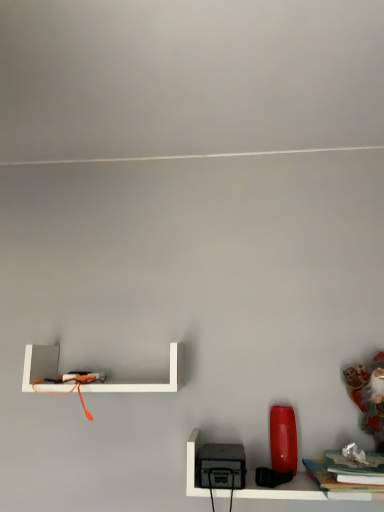
Question: Considering the relative sizes of matte black toaster at lower right, the first shelf from the right, and white matte shelf at upper left, marked as the 1th shelf in a left-to-right arrangement, in the image provided, is matte black toaster at lower right, the first shelf from the right, smaller than white matte shelf at upper left, marked as the 1th shelf in a left-to-right arrangement,?

Choices:
 (A) yes
 (B) no

Answer: (B)

Question: Can you confirm if matte black toaster at lower right, which is counted as the first shelf, starting from the bottom, is taller than white matte shelf at upper left, the 2th shelf ordered from the bottom?

Choices:
 (A) no
 (B) yes

Answer: (A)

Question: From a real-world perspective, is matte black toaster at lower right, the 2th shelf positioned from the top, positioned under white matte shelf at upper left, the 2th shelf ordered from the bottom, based on gravity?

Choices:
 (A) yes
 (B) no

Answer: (A)

Question: Is matte black toaster at lower right, the first shelf from the right, looking in the opposite direction of white matte shelf at upper left, marked as the 1th shelf in a left-to-right arrangement?

Choices:
 (A) yes
 (B) no

Answer: (B)

Question: Does matte black toaster at lower right, the first shelf from the right, have a lesser width compared to white matte shelf at upper left, marked as the 1th shelf in a left-to-right arrangement?

Choices:
 (A) yes
 (B) no

Answer: (B)

Question: Does matte black toaster at lower right, the first shelf from the right, appear on the left side of white matte shelf at upper left, marked as the 1th shelf in a left-to-right arrangement?

Choices:
 (A) yes
 (B) no

Answer: (B)

Question: Is hardcover book at lower right thinner than matte black toaster at lower right, which is counted as the first shelf, starting from the bottom?

Choices:
 (A) yes
 (B) no

Answer: (B)

Question: Is hardcover book at lower right positioned beyond the bounds of matte black toaster at lower right, the 2th shelf positioned from the left?

Choices:
 (A) yes
 (B) no

Answer: (B)

Question: Could you tell me if hardcover book at lower right is turned towards matte black toaster at lower right, the first shelf from the right?

Choices:
 (A) no
 (B) yes

Answer: (B)

Question: From the image's perspective, is hardcover book at lower right on matte black toaster at lower right, the 2th shelf positioned from the top?

Choices:
 (A) yes
 (B) no

Answer: (B)

Question: Is hardcover book at lower right smaller than matte black toaster at lower right, which is counted as the first shelf, starting from the bottom?

Choices:
 (A) no
 (B) yes

Answer: (B)

Question: Considering the relative positions of hardcover book at lower right and matte black toaster at lower right, the first shelf from the right, in the image provided, is hardcover book at lower right to the left of matte black toaster at lower right, the first shelf from the right, from the viewer's perspective?

Choices:
 (A) no
 (B) yes

Answer: (A)

Question: Is velvet santa at right positioned behind matte black toaster at lower right, which is counted as the first shelf, starting from the bottom?

Choices:
 (A) yes
 (B) no

Answer: (A)